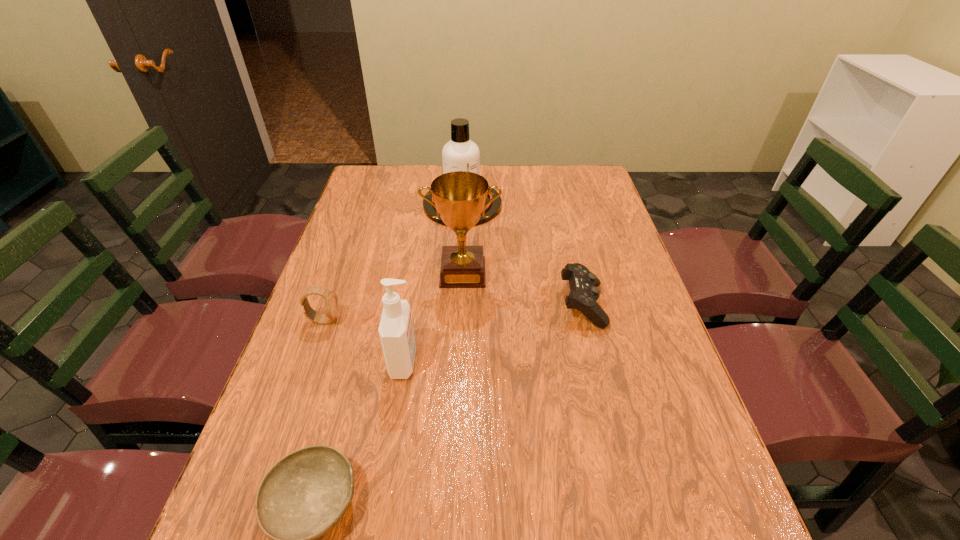
The width and height of the screenshot is (960, 540). What are the coordinates of `vacant space that satisfies the following two spatial constraints: 1. on the plaque of the award; 2. on the face of the watch` in the screenshot? It's located at (461, 320).

Image resolution: width=960 pixels, height=540 pixels. What are the coordinates of `free location that satisfies the following two spatial constraints: 1. on the front side of the second shortest object; 2. on the front label of the second nearest object` in the screenshot? It's located at (596, 362).